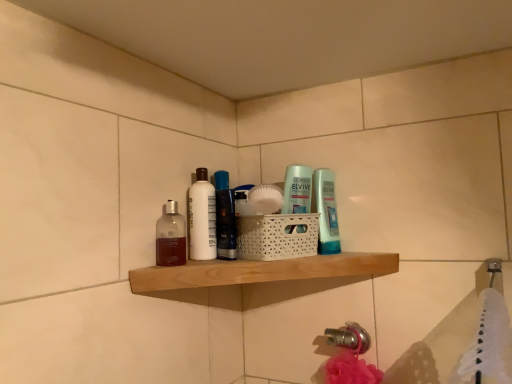
This screenshot has width=512, height=384. I want to click on free space to the right of translucent glass mouthwash at shelf center, positioned as the second mouthwash in back-to-front order, so click(230, 259).